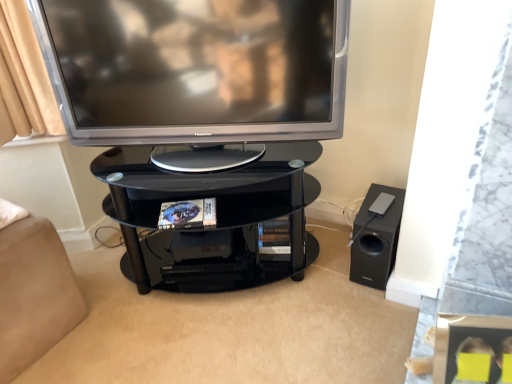
Question: From a real-world perspective, is beige fabric bed at lower left positioned over black matte speaker at lower right based on gravity?

Choices:
 (A) yes
 (B) no

Answer: (A)

Question: Could black matte speaker at lower right be considered to be inside beige fabric bed at lower left?

Choices:
 (A) no
 (B) yes

Answer: (A)

Question: Does beige fabric bed at lower left have a lesser width compared to black matte speaker at lower right?

Choices:
 (A) no
 (B) yes

Answer: (A)

Question: Does beige fabric bed at lower left have a smaller size compared to black matte speaker at lower right?

Choices:
 (A) yes
 (B) no

Answer: (B)

Question: Could you tell me if beige fabric bed at lower left is facing black matte speaker at lower right?

Choices:
 (A) yes
 (B) no

Answer: (B)

Question: Is the depth of beige fabric bed at lower left less than that of black matte speaker at lower right?

Choices:
 (A) no
 (B) yes

Answer: (B)

Question: Can you confirm if satin silver television at upper center is taller than beige fabric bed at lower left?

Choices:
 (A) no
 (B) yes

Answer: (B)

Question: Does satin silver television at upper center have a greater width compared to beige fabric bed at lower left?

Choices:
 (A) no
 (B) yes

Answer: (A)

Question: Is satin silver television at upper center positioned behind beige fabric bed at lower left?

Choices:
 (A) yes
 (B) no

Answer: (B)

Question: Is beige fabric bed at lower left located within satin silver television at upper center?

Choices:
 (A) yes
 (B) no

Answer: (B)

Question: Considering the relative positions of satin silver television at upper center and beige fabric bed at lower left in the image provided, is satin silver television at upper center to the left of beige fabric bed at lower left from the viewer's perspective?

Choices:
 (A) no
 (B) yes

Answer: (A)

Question: From a real-world perspective, is satin silver television at upper center positioned over beige fabric bed at lower left based on gravity?

Choices:
 (A) yes
 (B) no

Answer: (A)

Question: Can you confirm if black glass shelf at center is smaller than satin silver television at upper center?

Choices:
 (A) no
 (B) yes

Answer: (A)